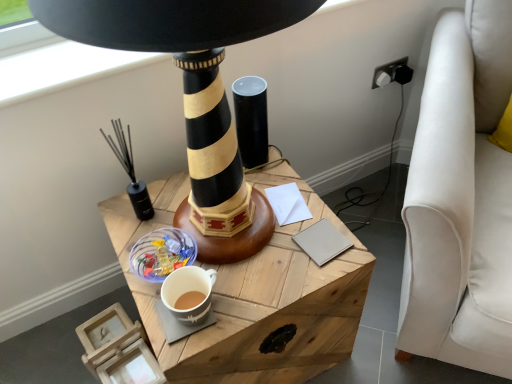
Question: Is black matte lighthouse at center shorter than wooden table at center?

Choices:
 (A) yes
 (B) no

Answer: (B)

Question: Are black matte lighthouse at center and wooden table at center making contact?

Choices:
 (A) yes
 (B) no

Answer: (B)

Question: Would you say black matte lighthouse at center is outside wooden table at center?

Choices:
 (A) yes
 (B) no

Answer: (A)

Question: From a real-world perspective, does black matte lighthouse at center stand above wooden table at center?

Choices:
 (A) no
 (B) yes

Answer: (B)

Question: From a real-world perspective, is black matte lighthouse at center located beneath wooden table at center?

Choices:
 (A) yes
 (B) no

Answer: (B)

Question: Does black matte lighthouse at center have a greater height compared to wooden table at center?

Choices:
 (A) no
 (B) yes

Answer: (B)

Question: Considering the relative positions of black plastic plug at upper right and beige leather notepad at center, placed as the 1th notepad when sorted from front to back, in the image provided, is black plastic plug at upper right to the left of beige leather notepad at center, placed as the 1th notepad when sorted from front to back, from the viewer's perspective?

Choices:
 (A) no
 (B) yes

Answer: (A)

Question: Is black plastic plug at upper right not within beige leather notepad at center, the second notepad positioned from the back?

Choices:
 (A) yes
 (B) no

Answer: (A)

Question: Is black plastic plug at upper right at the right side of beige leather notepad at center, the second notepad positioned from the back?

Choices:
 (A) yes
 (B) no

Answer: (A)

Question: From the image's perspective, would you say black plastic plug at upper right is shown under beige leather notepad at center, the second notepad positioned from the back?

Choices:
 (A) yes
 (B) no

Answer: (B)

Question: Considering the relative sizes of black plastic plug at upper right and beige leather notepad at center, placed as the 1th notepad when sorted from front to back, in the image provided, is black plastic plug at upper right thinner than beige leather notepad at center, placed as the 1th notepad when sorted from front to back,?

Choices:
 (A) no
 (B) yes

Answer: (B)

Question: From a real-world perspective, is black plastic plug at upper right on top of beige leather notepad at center, the second notepad positioned from the back?

Choices:
 (A) no
 (B) yes

Answer: (A)

Question: Does wooden table at center turn towards black matte candle holder at left, which is the 2th candle holder from right to left?

Choices:
 (A) yes
 (B) no

Answer: (B)